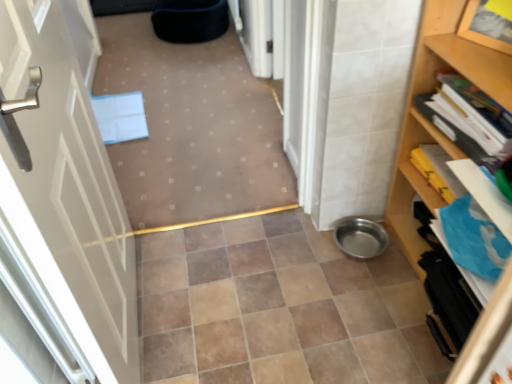
This screenshot has width=512, height=384. I want to click on vacant space behind white glossy door at left, so click(x=191, y=268).